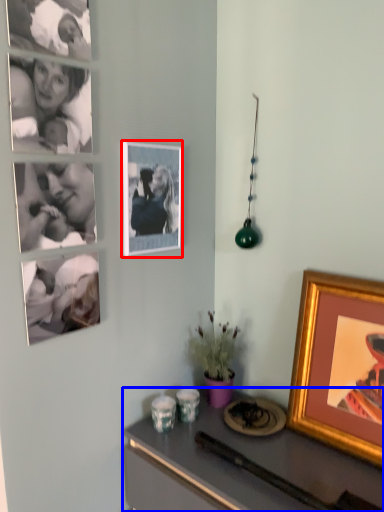
Question: Which object is closer to the camera taking this photo, picture frame (highlighted by a red box) or desk (highlighted by a blue box)?

Choices:
 (A) picture frame
 (B) desk

Answer: (B)